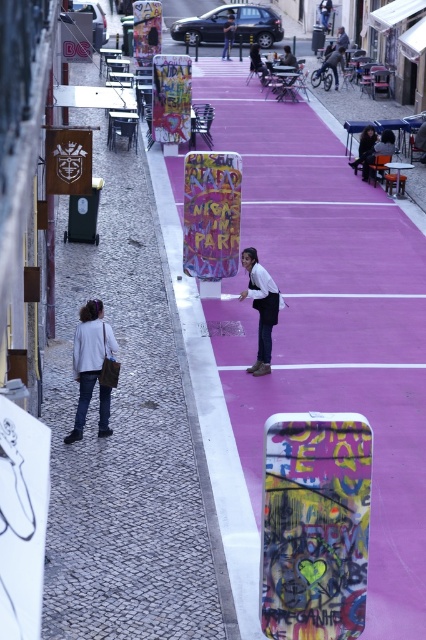
You are a tourist in this European city and want to take a photo of the vibrant pink walkway. However, there are two people in your viewfinder wearing jackets. The white matte jacket at lower left and the matte black jacket at upper center. Which jacket is positioned lower in the image?

The white matte jacket at lower left is positioned lower than the matte black jacket at upper center.